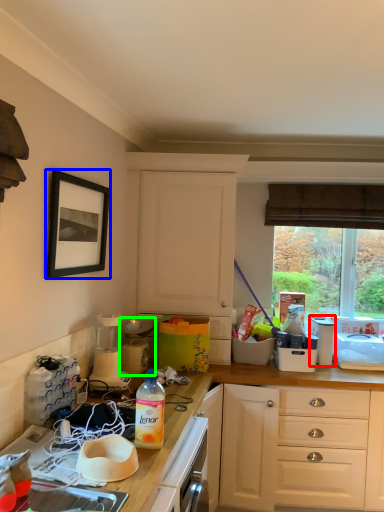
Question: Based on their relative distances, which object is nearer to appliance (highlighted by a red box)? Choose from picture frame (highlighted by a blue box) and appliance (highlighted by a green box).

Choices:
 (A) picture frame
 (B) appliance

Answer: (B)